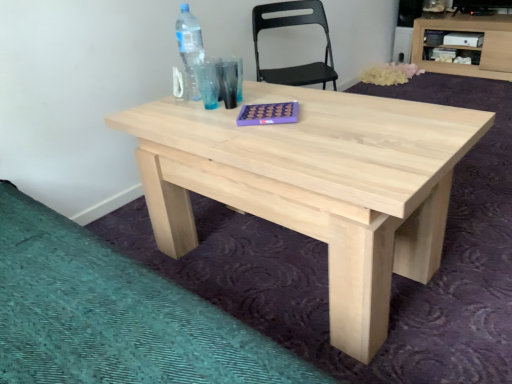
Question: Is transparent plastic bottle at upper left wider than black plastic chair at upper center?

Choices:
 (A) yes
 (B) no

Answer: (B)

Question: Considering the relative positions of transparent plastic bottle at upper left and black plastic chair at upper center in the image provided, is transparent plastic bottle at upper left to the left of black plastic chair at upper center from the viewer's perspective?

Choices:
 (A) yes
 (B) no

Answer: (A)

Question: Considering the relative sizes of transparent plastic bottle at upper left and black plastic chair at upper center in the image provided, is transparent plastic bottle at upper left taller than black plastic chair at upper center?

Choices:
 (A) yes
 (B) no

Answer: (B)

Question: Does transparent plastic bottle at upper left have a smaller size compared to black plastic chair at upper center?

Choices:
 (A) yes
 (B) no

Answer: (A)

Question: Would you consider transparent plastic bottle at upper left to be distant from black plastic chair at upper center?

Choices:
 (A) yes
 (B) no

Answer: (B)

Question: Is light wood/unfinished wood computer desk at upper right bigger or smaller than transparent plastic bottle at upper left?

Choices:
 (A) small
 (B) big

Answer: (B)

Question: From a real-world perspective, relative to transparent plastic bottle at upper left, is light wood/unfinished wood computer desk at upper right vertically above or below?

Choices:
 (A) above
 (B) below

Answer: (B)

Question: Visually, is light wood/unfinished wood computer desk at upper right positioned to the left or to the right of transparent plastic bottle at upper left?

Choices:
 (A) right
 (B) left

Answer: (A)

Question: Looking at their shapes, would you say light wood/unfinished wood computer desk at upper right is wider or thinner than transparent plastic bottle at upper left?

Choices:
 (A) thin
 (B) wide

Answer: (B)

Question: In the image, is transparent plastic bottle at upper left positioned in front of or behind natural wood table at center?

Choices:
 (A) front
 (B) behind

Answer: (B)

Question: Is point (186, 13) closer or farther from the camera than point (382, 230)?

Choices:
 (A) farther
 (B) closer

Answer: (A)

Question: Is transparent plastic bottle at upper left taller or shorter than natural wood table at center?

Choices:
 (A) short
 (B) tall

Answer: (B)

Question: From a real-world perspective, relative to natural wood table at center, is transparent plastic bottle at upper left vertically above or below?

Choices:
 (A) above
 (B) below

Answer: (A)

Question: From their relative heights in the image, would you say black plastic chair at upper center is taller or shorter than light wood/unfinished wood computer desk at upper right?

Choices:
 (A) tall
 (B) short

Answer: (A)

Question: Is black plastic chair at upper center wider or thinner than light wood/unfinished wood computer desk at upper right?

Choices:
 (A) thin
 (B) wide

Answer: (A)